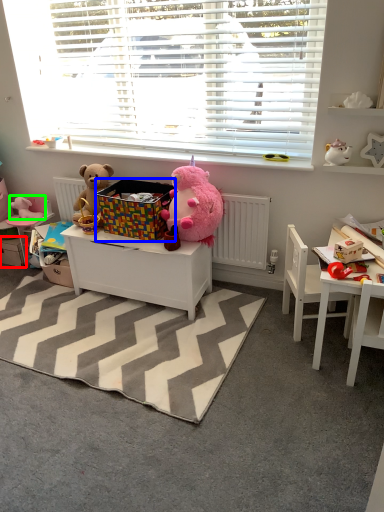
Question: Which is nearer to the drawer (highlighted by a red box)? crate (highlighted by a blue box) or toy (highlighted by a green box).

Choices:
 (A) crate
 (B) toy

Answer: (B)